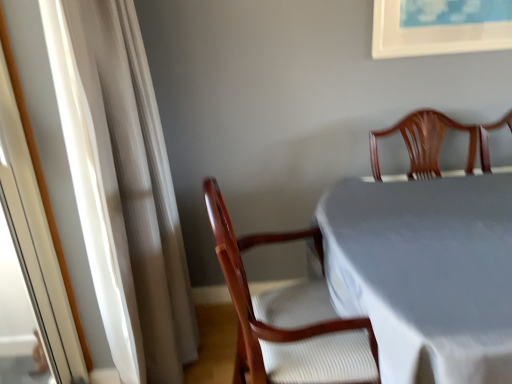
Question: Is wooden chair at center oriented away from white sheer curtain at left?

Choices:
 (A) yes
 (B) no

Answer: (A)

Question: Does wooden chair at center turn towards white sheer curtain at left?

Choices:
 (A) yes
 (B) no

Answer: (B)

Question: Is wooden chair at center with white sheer curtain at left?

Choices:
 (A) yes
 (B) no

Answer: (B)

Question: Does wooden chair at center come behind white sheer curtain at left?

Choices:
 (A) no
 (B) yes

Answer: (B)

Question: Does wooden chair at center appear on the right side of white sheer curtain at left?

Choices:
 (A) yes
 (B) no

Answer: (A)

Question: Can you confirm if wooden chair at center is taller than white sheer curtain at left?

Choices:
 (A) yes
 (B) no

Answer: (B)

Question: Is white sheer curtain at left far away from white cloth-covered table at center?

Choices:
 (A) yes
 (B) no

Answer: (B)

Question: Is white sheer curtain at left with white cloth-covered table at center?

Choices:
 (A) yes
 (B) no

Answer: (B)

Question: Is white sheer curtain at left to the left of white cloth-covered table at center from the viewer's perspective?

Choices:
 (A) no
 (B) yes

Answer: (B)

Question: Can you confirm if white sheer curtain at left is positioned to the right of white cloth-covered table at center?

Choices:
 (A) no
 (B) yes

Answer: (A)

Question: Is white sheer curtain at left thinner than white cloth-covered table at center?

Choices:
 (A) yes
 (B) no

Answer: (A)

Question: Is white sheer curtain at left completely or partially outside of white cloth-covered table at center?

Choices:
 (A) no
 (B) yes

Answer: (B)

Question: Does white sheer curtain at left lie in front of wooden chair at center?

Choices:
 (A) no
 (B) yes

Answer: (B)